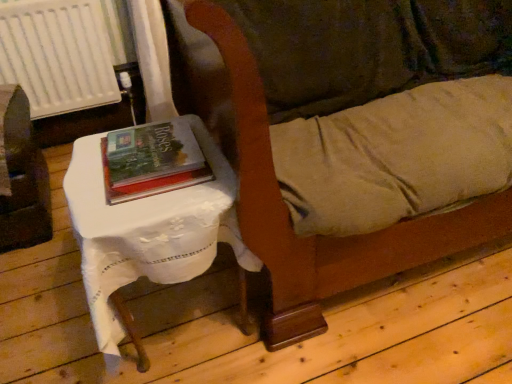
Locate an element on the screen. vacant point above white cloth-covered table at left (from a real-world perspective) is located at coordinates (126, 192).